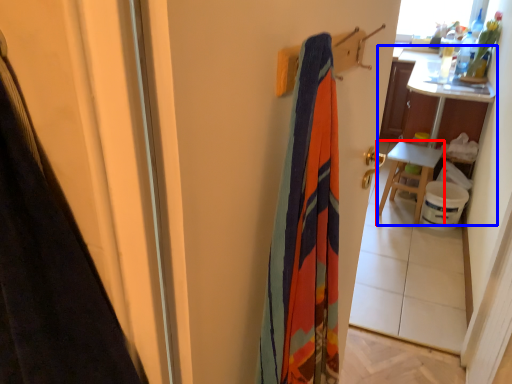
Question: Among these objects, which one is farthest to the camera, furniture (highlighted by a red box) or table (highlighted by a blue box)?

Choices:
 (A) furniture
 (B) table

Answer: (A)